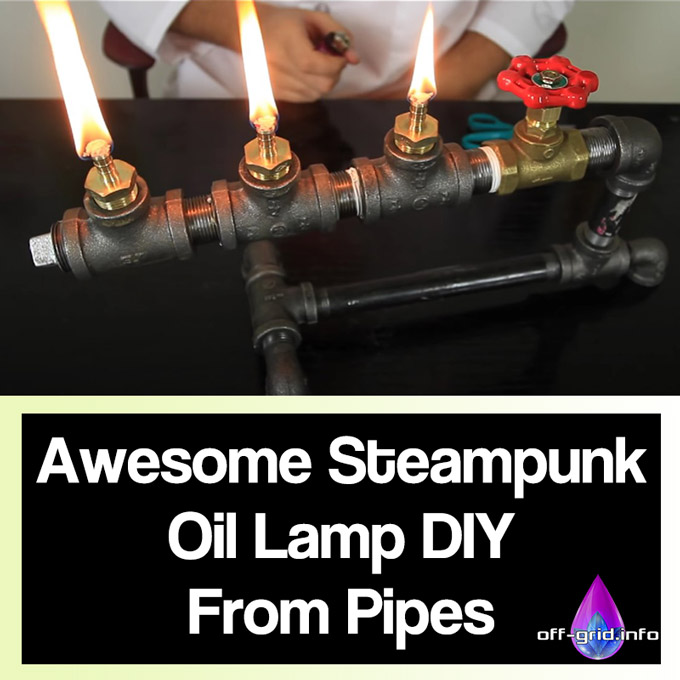
Locate an element on the screen. table is located at coordinates (177, 358).